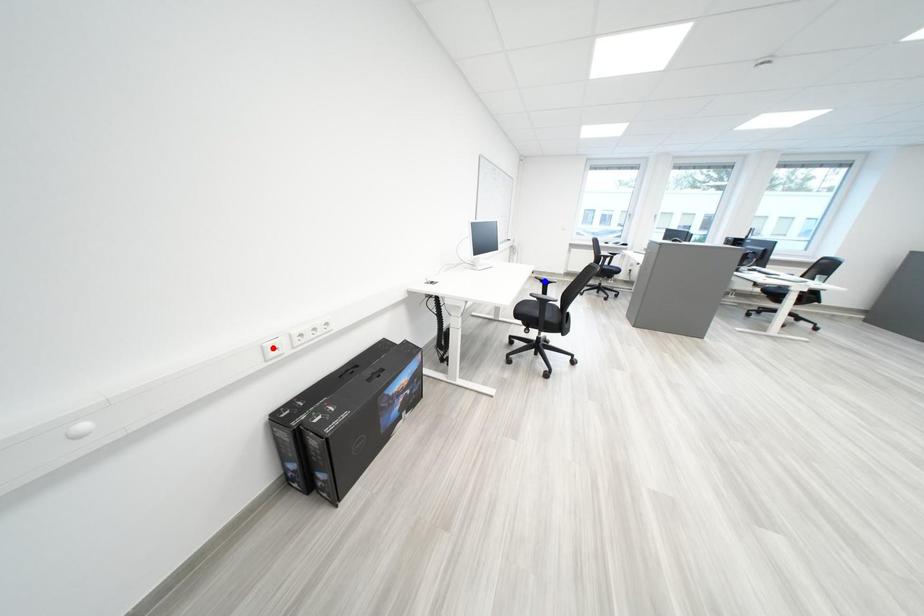
Question: Two points are marked on the image. Which point is closer to the camera?

Choices:
 (A) Blue point is closer.
 (B) Red point is closer.

Answer: (B)